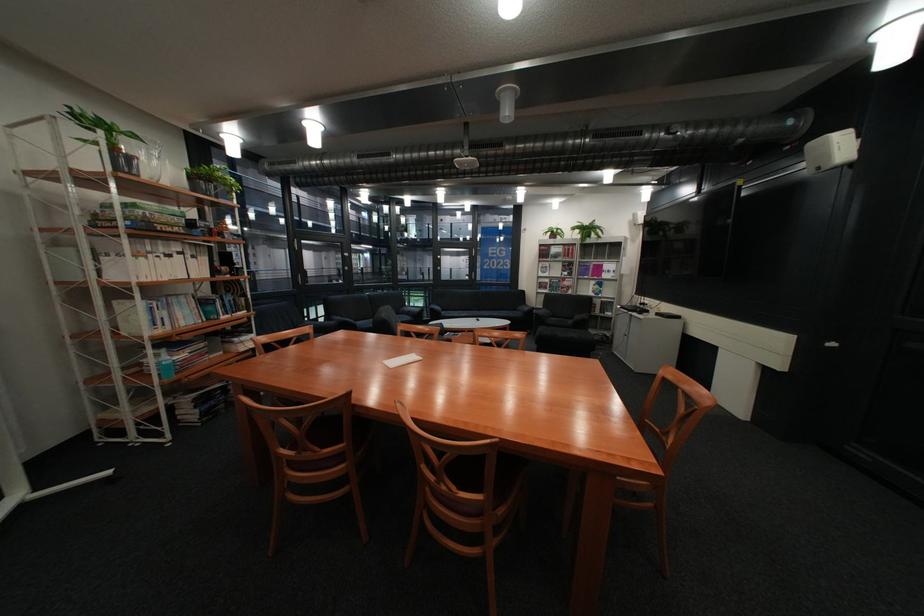
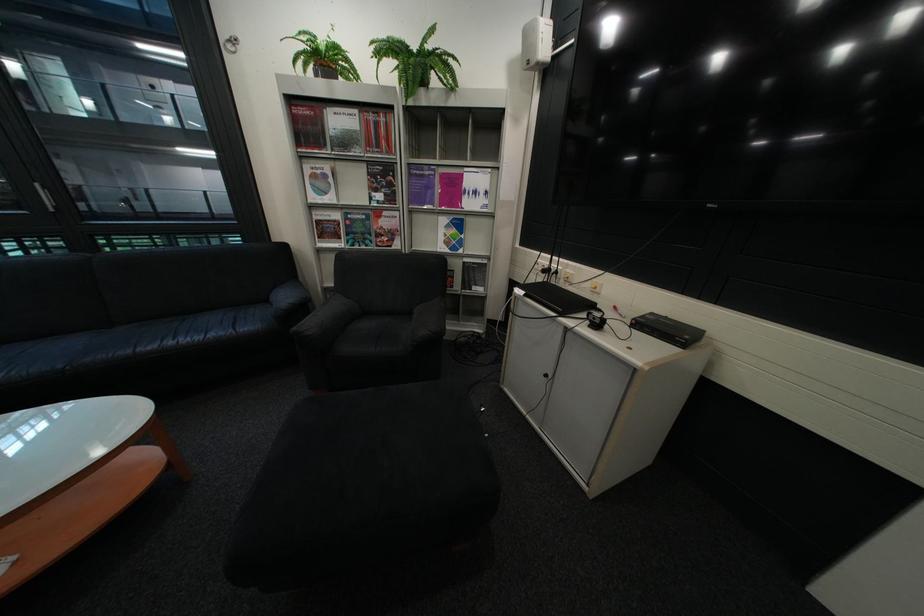
Find the pixel in the second image that matches the point at 636,307 in the first image.

(538, 293)